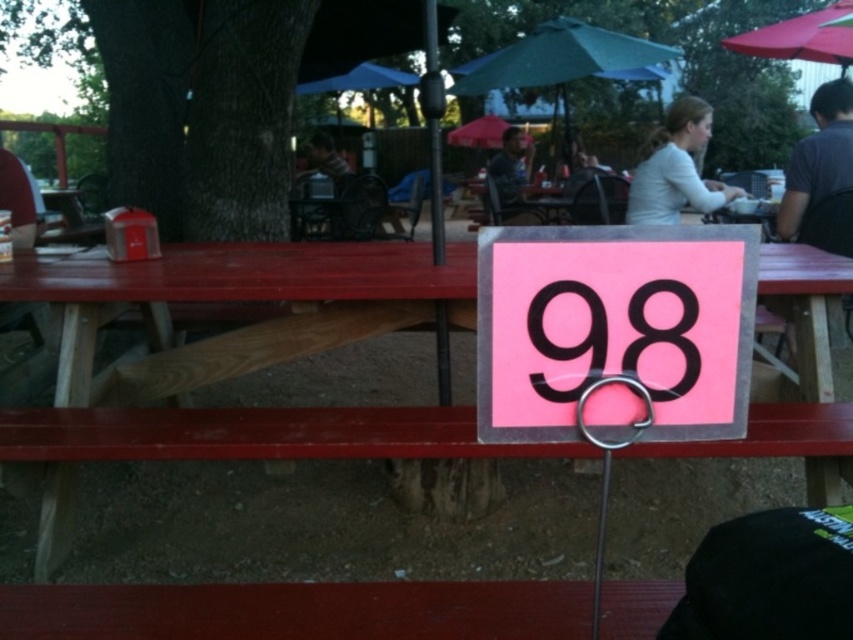
Is green fabric umbrella at upper center to the right of matte black shirt at upper center from the viewer's perspective?

Indeed, green fabric umbrella at upper center is positioned on the right side of matte black shirt at upper center.

Is green fabric umbrella at upper center to the left of matte black shirt at upper center from the viewer's perspective?

In fact, green fabric umbrella at upper center is to the right of matte black shirt at upper center.

This screenshot has width=853, height=640. Find the location of `green fabric umbrella at upper center`. green fabric umbrella at upper center is located at coordinates (561, 58).

Is point (549, 392) less distant than point (762, 29)?

That is True.

Between pink matte sign at center and red fabric umbrella at upper right, which one appears on the left side from the viewer's perspective?

pink matte sign at center

Which is behind, point (548, 340) or point (811, 44)?

Positioned behind is point (811, 44).

Locate an element on the screen. This screenshot has width=853, height=640. pink matte sign at center is located at coordinates (567, 346).

Who is positioned more to the left, green fabric umbrella at upper center or pink matte sign at center?

From the viewer's perspective, pink matte sign at center appears more on the left side.

Is point (466, 81) closer to camera compared to point (663, 392)?

That is False.

At what (x,y) coordinates should I click in order to perform the action: click on green fabric umbrella at upper center. Please return your answer as a coordinate pair (x, y). The image size is (853, 640). Looking at the image, I should click on (561, 58).